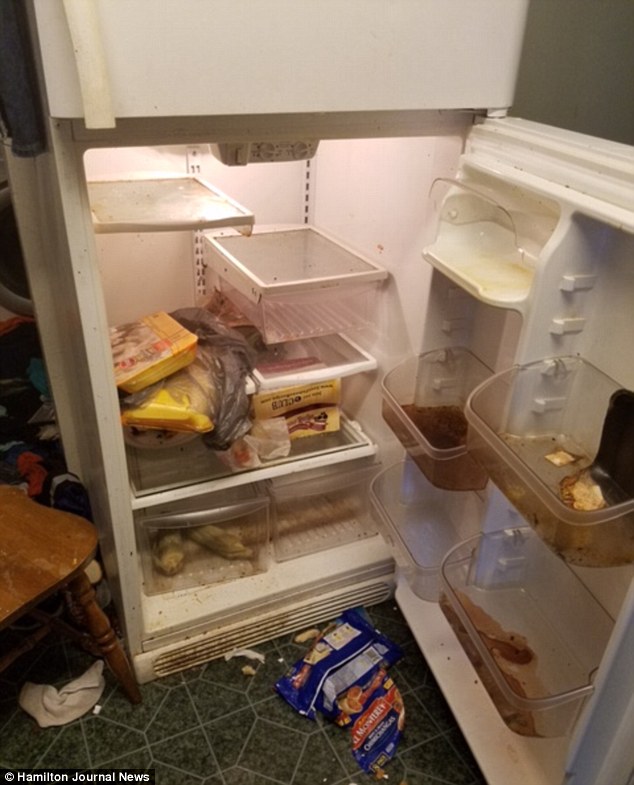
Please find where you'd sit in the image and show me where they are. Your answer should be formatted as a list of tuples, i.e. [(x1, y1), (x2, y2), ...], where each tuple contains the x and y coordinates of a point satisfying the conditions above.

[(55, 560)]